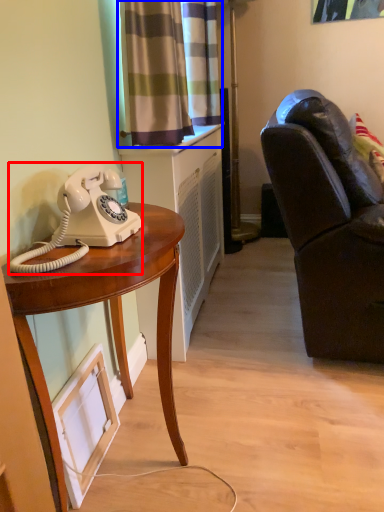
Question: Which object is further to the camera taking this photo, corded phone (highlighted by a red box) or curtain (highlighted by a blue box)?

Choices:
 (A) corded phone
 (B) curtain

Answer: (B)